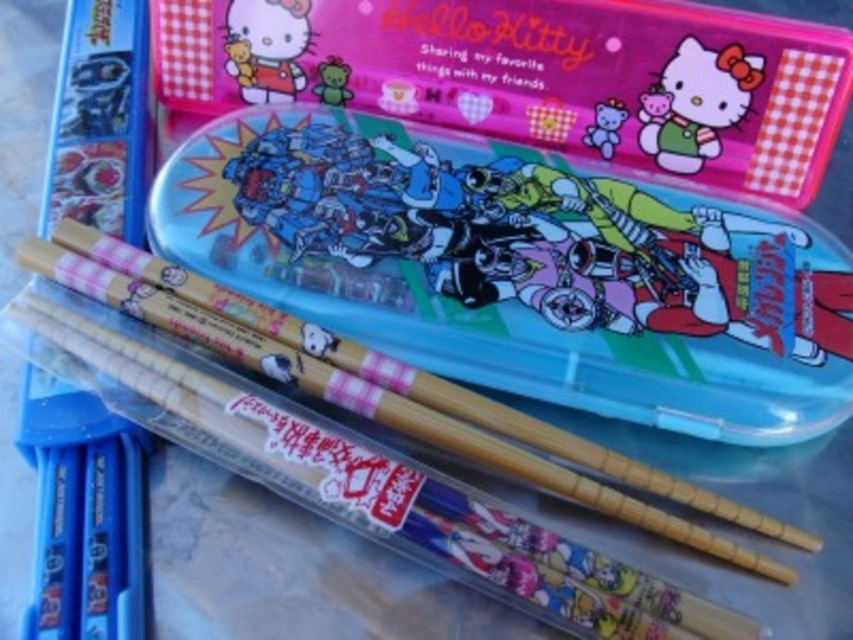
You are organizing a picnic basket and need to fit both the wooden chopsticks at center and the matte pink plush bear at upper center. Which item might require more width in the basket?

The wooden chopsticks at center might require more width in the basket since they are wider than the matte pink plush bear at upper center.

You are organizing a stationery set and need to place the wooden chopsticks at center and the pink glossy hello kitty at upper center into a storage box. Which object will require more space due to its size?

The wooden chopsticks at center is larger in size than the pink glossy hello kitty at upper center, so it will require more space in the storage box.

You are organizing a stationery set and need to place the pink glossy hello kitty at upper center and the matte plastic chopsticks at lower left into a display case. The display case has a divider that separates items into left and right sections. If you want to maintain their original spatial relationship from the image, which side should each item be placed on?

The pink glossy hello kitty at upper center should be placed on the right side and the matte plastic chopsticks at lower left on the left side of the display case to maintain their original spatial relationship where the pink glossy hello kitty is positioned on the right side of the matte plastic chopsticks at lower left.